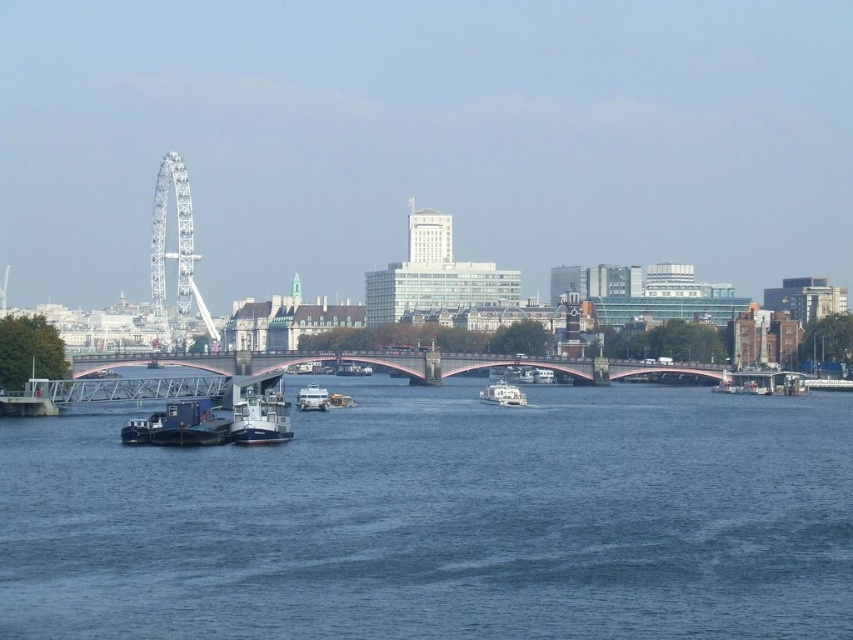
What do you see at coordinates (343, 360) in the screenshot? I see `metallic bridge at center` at bounding box center [343, 360].

Measure the distance between metallic bridge at center and camera.

The distance of metallic bridge at center from camera is 125.89 meters.

Where is `metallic bridge at center`? metallic bridge at center is located at coordinates (343, 360).

I want to click on metallic bridge at center, so click(x=343, y=360).

Between point (219, 362) and point (509, 392), which one is positioned behind?

Positioned behind is point (219, 362).

Between metallic bridge at center and white glossy boat at center, which one appears on the left side from the viewer's perspective?

Positioned to the left is metallic bridge at center.

Who is more distant from viewer, (474, 369) or (503, 401)?

Positioned behind is point (474, 369).

At what (x,y) coordinates should I click in order to perform the action: click on metallic bridge at center. Please return your answer as a coordinate pair (x, y). This screenshot has height=640, width=853. Looking at the image, I should click on (343, 360).

Is blue water at center shorter than metallic blue barge at lower left?

Incorrect, blue water at center's height does not fall short of metallic blue barge at lower left's.

Between blue water at center and metallic blue barge at lower left, which one appears on the right side from the viewer's perspective?

Positioned to the right is blue water at center.

Does point (364, 424) come behind point (146, 426)?

Yes, point (364, 424) is behind point (146, 426).

Identify the location of blue water at center. This screenshot has width=853, height=640. (440, 520).